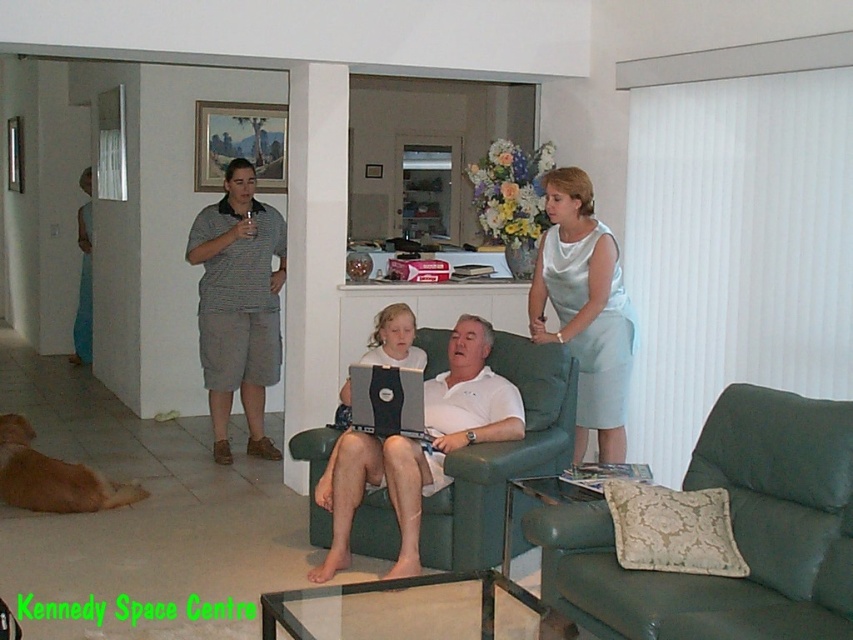
Question: Which point is farther to the camera?

Choices:
 (A) green leather couch at lower right
 (B) matte black laptop at center
 (C) black matte laptop at center
 (D) striped cotton shirt at left

Answer: (D)

Question: Can you confirm if green leather couch at lower right is smaller than white matte laptop at center?

Choices:
 (A) yes
 (B) no

Answer: (B)

Question: Which of these objects is positioned closest to the light blue satin dress at right?

Choices:
 (A) white matte laptop at center
 (B) striped cotton shirt at left

Answer: (A)

Question: Is green leather couch at lower right further to the viewer compared to white matte laptop at center?

Choices:
 (A) no
 (B) yes

Answer: (A)

Question: Which point is closer to the camera?

Choices:
 (A) green leather couch at lower right
 (B) matte black laptop at center

Answer: (A)

Question: Is green leather couch at lower right to the left of light blue satin dress at right from the viewer's perspective?

Choices:
 (A) no
 (B) yes

Answer: (A)